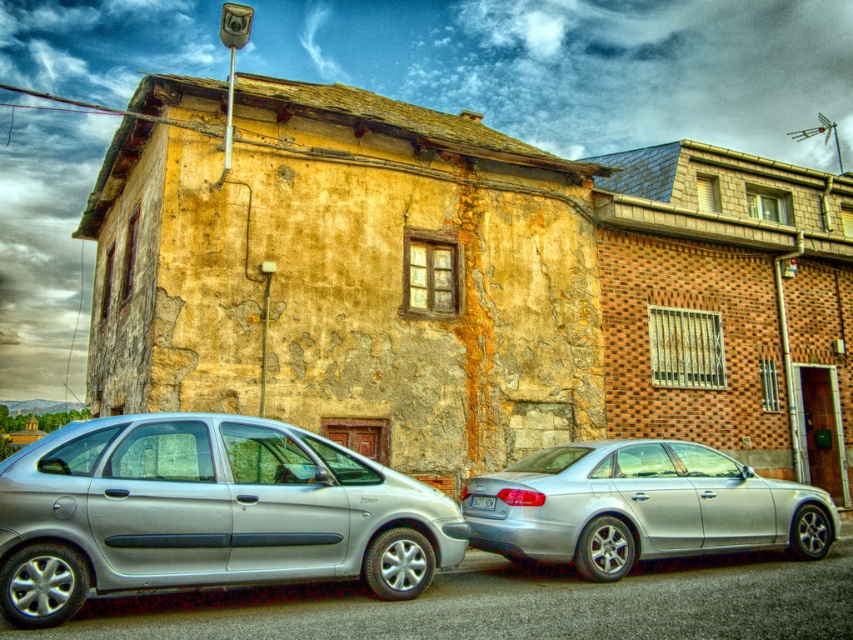
You are standing in front of the two parked silver sedans in front of the weathered building. You notice two points marked on the ground. The first point is at coordinates point (x=48, y=556) and the second point is at point (x=492, y=476). Which point is closer to you as you face the cars?

Point (x=48, y=556) is in front of point (x=492, y=476), so the first point is closer to you.

You are a delivery driver who needs to park your vehicle between the silver metallic hatchback at lower left and the white plastic license plate at center. Is there enough space for your car, which is 4.5 meters long, between them?

The silver metallic hatchback at lower left is positioned on the left side of the white plastic license plate at center. However, the exact distance between them isn t provided, so it s impossible to determine if there s enough space for a 4.5 meter car.